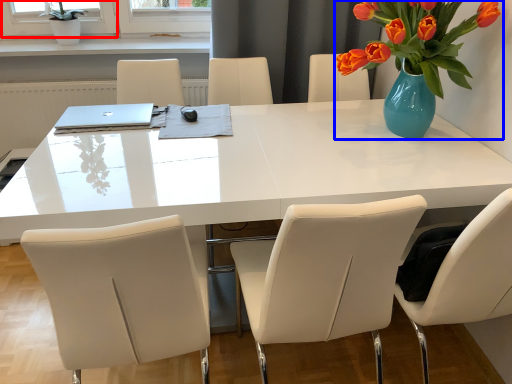
Question: Which of the following is the farthest to the observer, window screen (highlighted by a red box) or houseplant (highlighted by a blue box)?

Choices:
 (A) window screen
 (B) houseplant

Answer: (A)